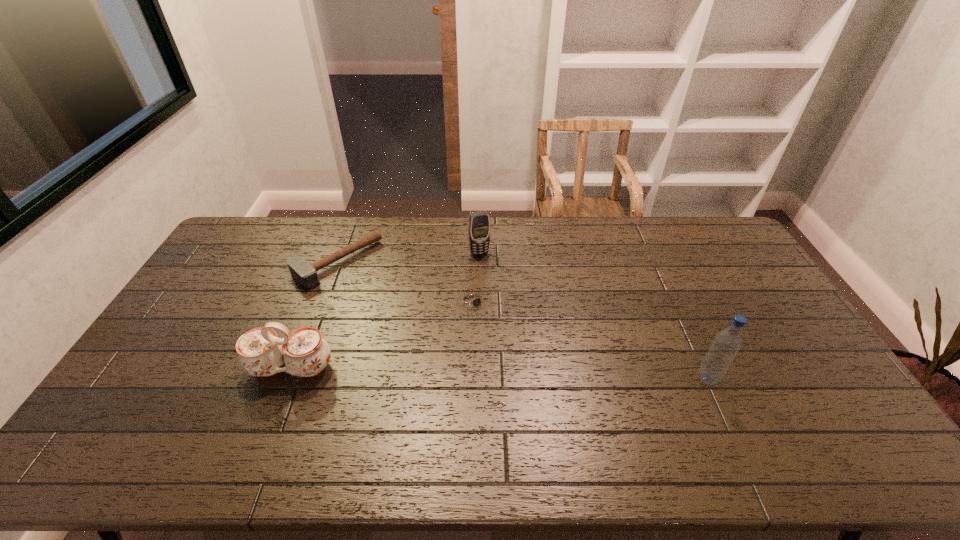
The height and width of the screenshot is (540, 960). I want to click on vacant space that's between the water bottle and the cellular telephone, so click(593, 316).

I want to click on free space between the tallest object and the cellular telephone, so click(x=593, y=316).

Find the location of a particular element. The image size is (960, 540). free point between the tallest object and the chinaware is located at coordinates (499, 373).

The height and width of the screenshot is (540, 960). I want to click on vacant area that lies between the shortest object and the cellular telephone, so click(477, 277).

The width and height of the screenshot is (960, 540). What are the coordinates of `object identified as the fourth closest to the rightmost object` in the screenshot? It's located at (305, 274).

The width and height of the screenshot is (960, 540). I want to click on the third closest object to the fourth tallest object, so click(479, 222).

The width and height of the screenshot is (960, 540). What are the coordinates of `blank area in the image that satisfies the following two spatial constraints: 1. on the front side of the cellular telephone; 2. on the left side of the tallest object` in the screenshot? It's located at (479, 379).

At what (x,y) coordinates should I click in order to perform the action: click on free spot that satisfies the following two spatial constraints: 1. on the front side of the fourth tallest object; 2. on the left side of the water bottle. Please return your answer as a coordinate pair (x, y). The width and height of the screenshot is (960, 540). Looking at the image, I should click on (293, 379).

This screenshot has width=960, height=540. I want to click on free space that satisfies the following two spatial constraints: 1. on the back side of the shortest object; 2. on the right side of the cellular telephone, so click(x=475, y=253).

Locate an element on the screen. Image resolution: width=960 pixels, height=540 pixels. free spot that satisfies the following two spatial constraints: 1. on the front side of the tallest object; 2. on the right side of the cellular telephone is located at coordinates 479,379.